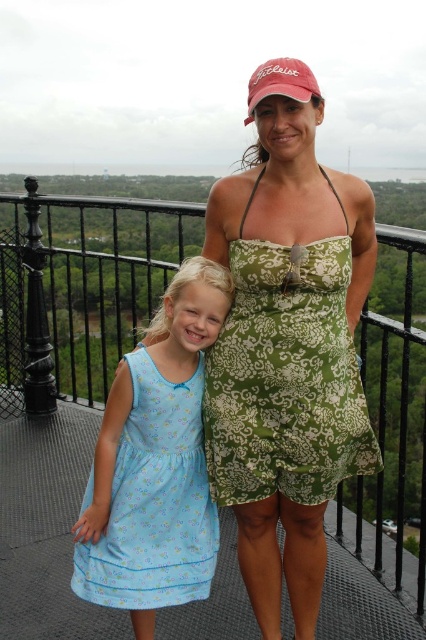
Question: Which of the following is the farthest from the observer?

Choices:
 (A) (69, 346)
 (B) (210, 538)
 (C) (345, 422)

Answer: (A)

Question: Is green printed dress at center further to camera compared to black metal railing at upper center?

Choices:
 (A) yes
 (B) no

Answer: (B)

Question: Is black metal railing at upper center thinner than light blue fabric dress at left?

Choices:
 (A) yes
 (B) no

Answer: (B)

Question: Which point is closer to the camera taking this photo?

Choices:
 (A) (135, 209)
 (B) (166, 465)

Answer: (B)

Question: Can you confirm if green printed dress at center is wider than black metal railing at upper center?

Choices:
 (A) no
 (B) yes

Answer: (A)

Question: Which of these objects is positioned closest to the light blue fabric dress at left?

Choices:
 (A) green printed dress at center
 (B) black metal railing at upper center

Answer: (A)